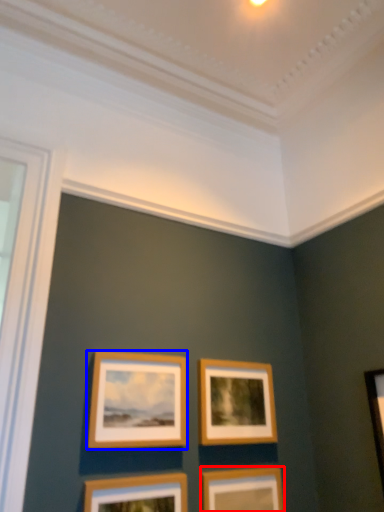
Question: Which object appears farthest to the camera in this image, picture frame (highlighted by a red box) or picture frame (highlighted by a blue box)?

Choices:
 (A) picture frame
 (B) picture frame

Answer: (A)